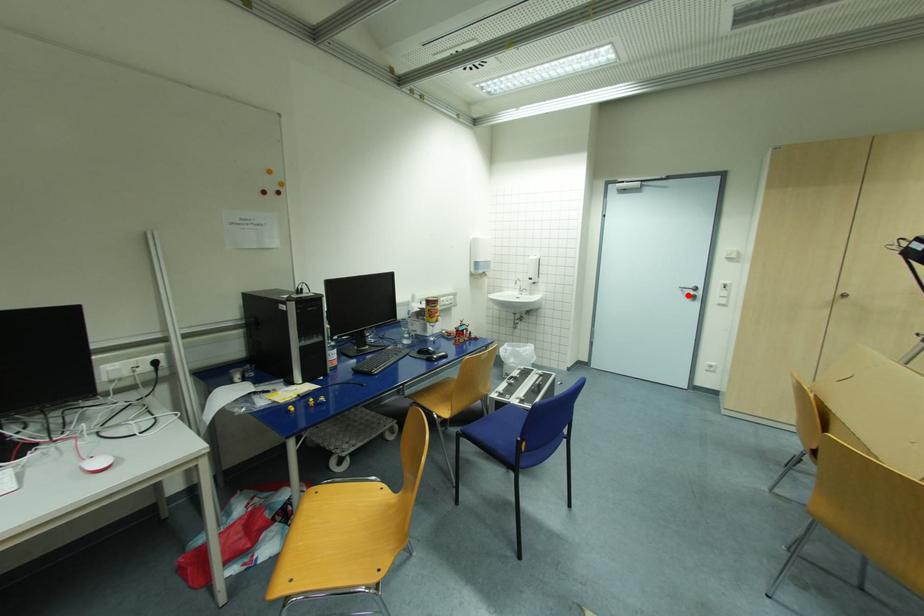
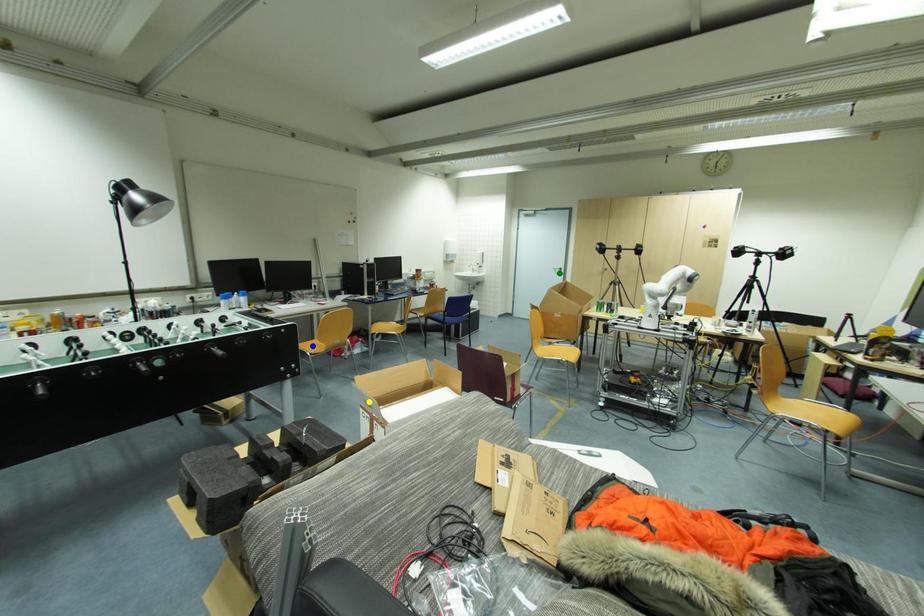
Question: I am providing you with two images of the same scene from different viewpoints. A red point is marked on the first image. You are given multiple points on the second image. Which point in image 2 represents the same 3d spot as the red point in image 1?

Choices:
 (A) yellow point
 (B) blue point
 (C) green point

Answer: (C)